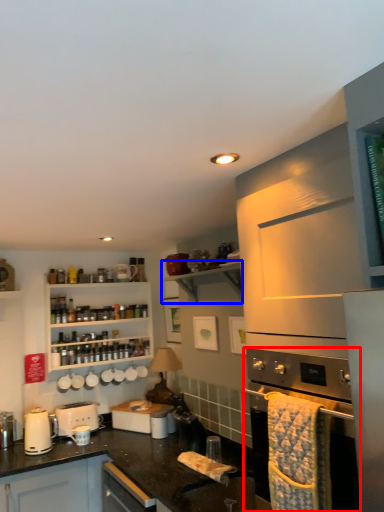
Question: Which of the following is the farthest to the observer, home appliance (highlighted by a red box) or shelf (highlighted by a blue box)?

Choices:
 (A) home appliance
 (B) shelf

Answer: (B)